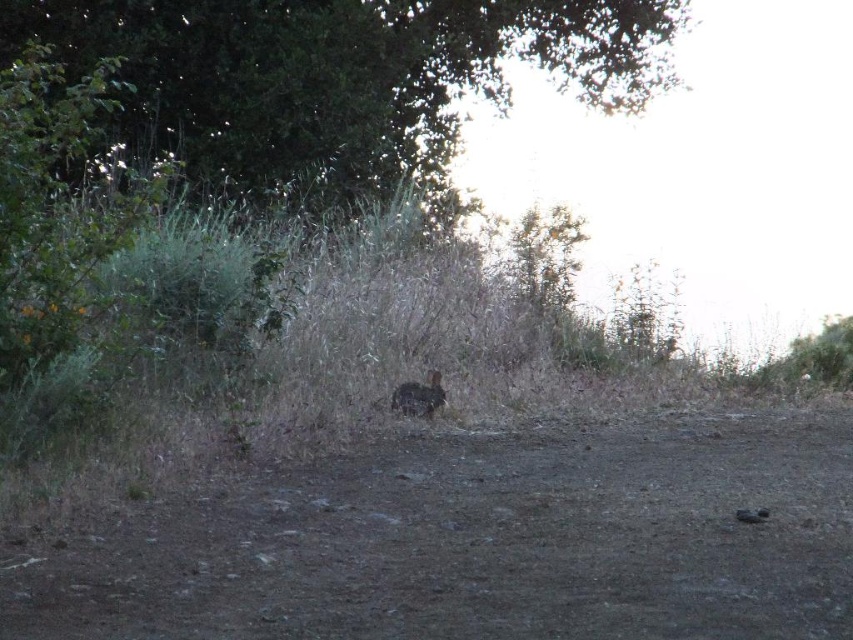
Who is more distant from viewer, (305, 509) or (403, 384)?

Point (403, 384)

You are a GUI agent. You are given a task and a screenshot of the screen. Output one action in this format:
    pyautogui.click(x=<x>, y=<y>)
    Task: Click on the dull brown dirt at center
    
    Given the screenshot: What is the action you would take?
    pyautogui.click(x=480, y=545)

Who is more forward, (293, 108) or (431, 374)?

Point (431, 374)

What do you see at coordinates (339, 76) in the screenshot? The width and height of the screenshot is (853, 640). I see `green leafy tree at upper center` at bounding box center [339, 76].

Describe the element at coordinates (339, 76) in the screenshot. Image resolution: width=853 pixels, height=640 pixels. I see `green leafy tree at upper center` at that location.

Where is `green leafy tree at upper center`? The height and width of the screenshot is (640, 853). green leafy tree at upper center is located at coordinates (339, 76).

Locate an element on the screen. The width and height of the screenshot is (853, 640). dull brown dirt at center is located at coordinates (480, 545).

Who is more distant from viewer, (x=251, y=512) or (x=318, y=58)?

→ Positioned behind is point (x=318, y=58).

Does point (155, 520) come farther from viewer compared to point (346, 202)?

That is False.

At what (x,y) coordinates should I click in order to perform the action: click on dull brown dirt at center. Please return your answer as a coordinate pair (x, y). The height and width of the screenshot is (640, 853). Looking at the image, I should click on (480, 545).